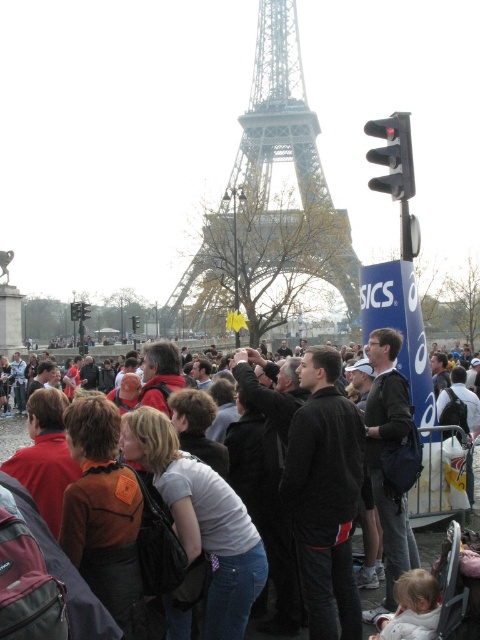
At what (x,y) coordinates should I click in order to perform the action: click on metallic silver eiffel tower at center. Please return your answer as a coordinate pair (x, y). This screenshot has height=640, width=480. Looking at the image, I should click on (268, 204).

Is metallic silver eiffel tower at center above dark gray jacket at center?

Correct, metallic silver eiffel tower at center is located above dark gray jacket at center.

Which is behind, point (220, 236) or point (419, 531)?

The point (220, 236) is more distant.

I want to click on metallic silver eiffel tower at center, so click(268, 204).